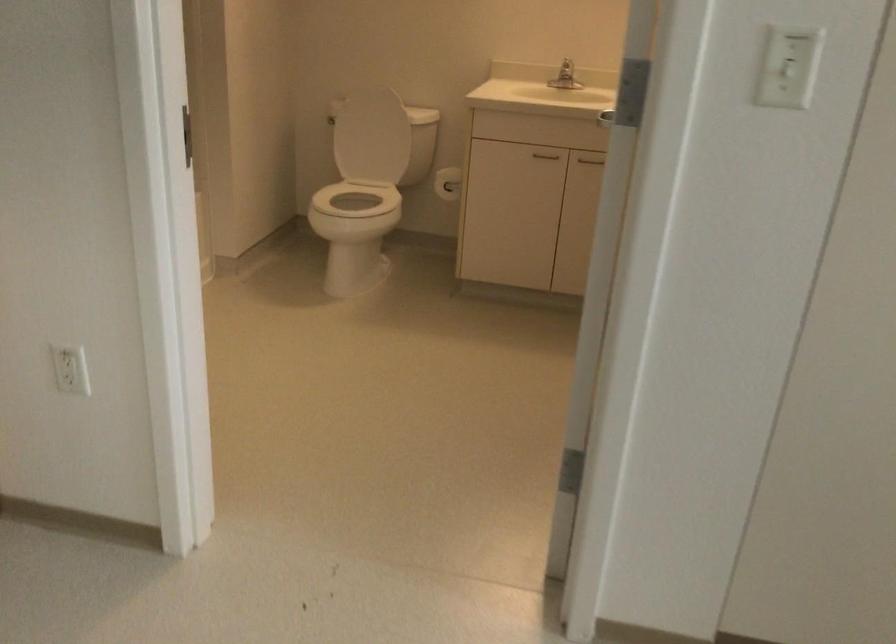
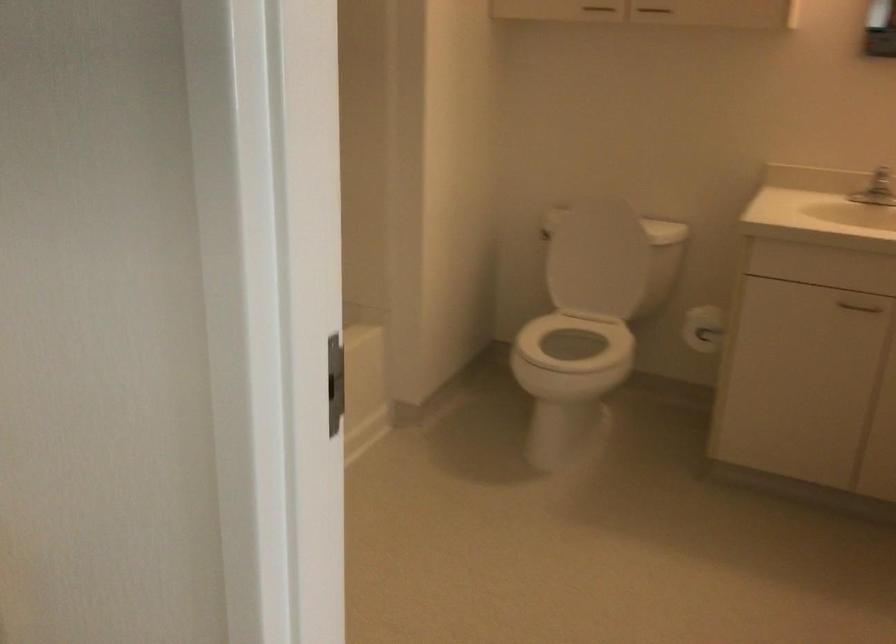
Question: The camera is either moving clockwise (left) or counter-clockwise (right) around the object. The first image is from the beginning of the video and the second image is from the end. Is the camera moving left or right when shooting the video?

Choices:
 (A) Left
 (B) Right

Answer: (B)